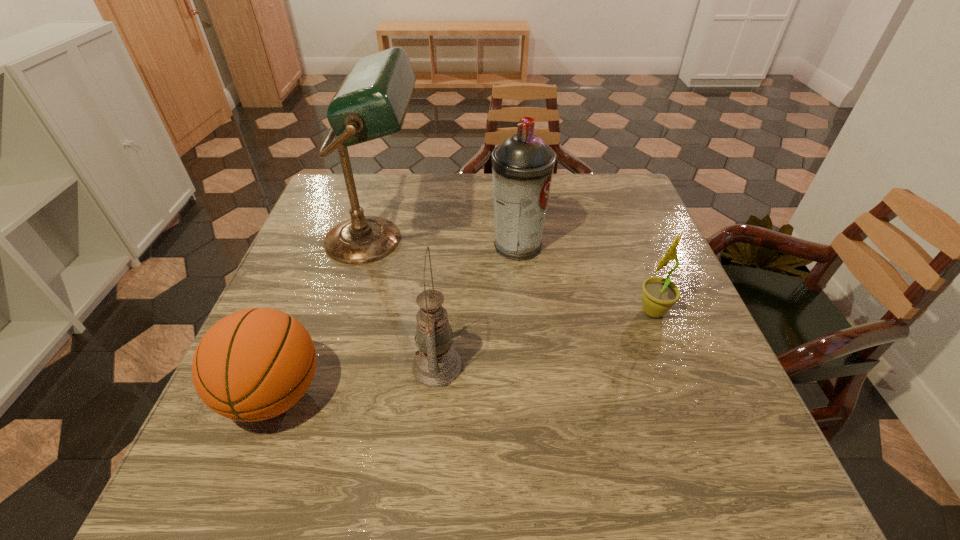
This screenshot has height=540, width=960. In order to click on free space that satisfies the following two spatial constraints: 1. above the green lampshade of the tallest object; 2. on the back side of the fourth object from left to right in this screenshot , I will do `click(373, 246)`.

At what (x,y) coordinates should I click in order to perform the action: click on free space that satisfies the following two spatial constraints: 1. on the back side of the basketball; 2. on the left side of the third object from left to right. Please return your answer as a coordinate pair (x, y). This screenshot has width=960, height=540. Looking at the image, I should click on (285, 366).

Locate an element on the screen. The image size is (960, 540). blank space that satisfies the following two spatial constraints: 1. above the green lampshade of the aerosol can; 2. on the left side of the tallest object is located at coordinates (373, 246).

In order to click on free space that satisfies the following two spatial constraints: 1. on the face of the third farthest object; 2. on the front side of the basketball in this screenshot , I will do [684, 394].